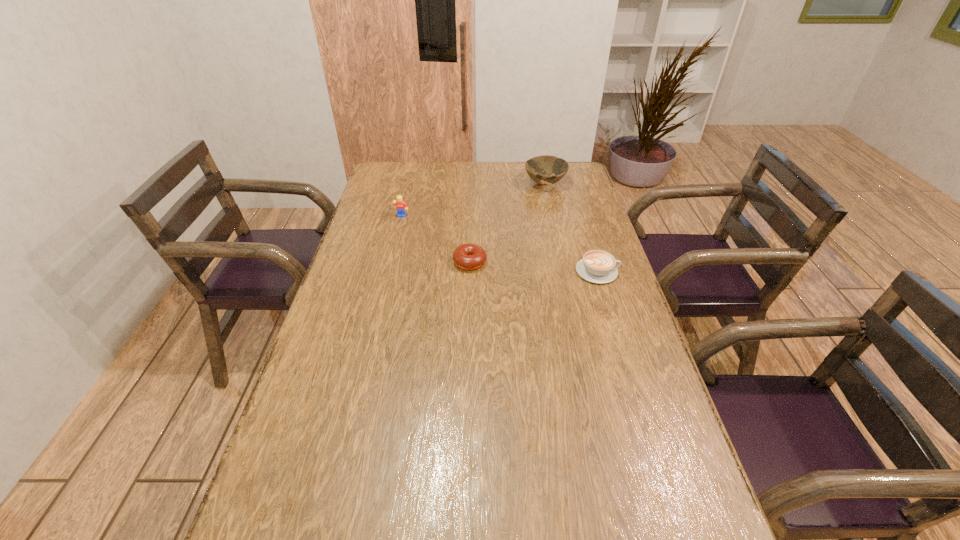
Where is `bowl`? bowl is located at coordinates (538, 168).

Find the location of a particular element. Image resolution: width=960 pixels, height=540 pixels. the leftmost object is located at coordinates (401, 206).

Identify the location of the third nearest object. (401, 206).

Locate an element on the screen. The width and height of the screenshot is (960, 540). cappuccino is located at coordinates (597, 266).

Identify the location of the second object from left to right. The width and height of the screenshot is (960, 540). (467, 256).

Locate an element on the screen. This screenshot has height=540, width=960. vacant space located 0.070m on the right of the bowl is located at coordinates (583, 184).

The image size is (960, 540). In order to click on blank area located 0.250m on the face of the Lego in this screenshot , I will do `click(391, 262)`.

Identify the location of vacant space located on the back of the doughnut. Image resolution: width=960 pixels, height=540 pixels. (470, 222).

Where is `object at the far edge`? Image resolution: width=960 pixels, height=540 pixels. object at the far edge is located at coordinates (538, 168).

Find the location of a particular element. Image resolution: width=960 pixels, height=540 pixels. object situated at the left edge is located at coordinates (401, 206).